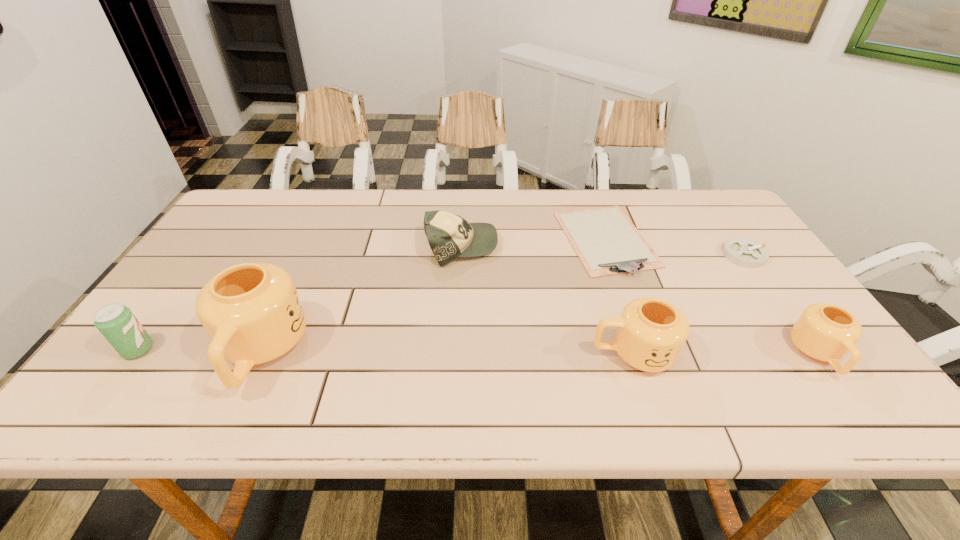
Where is `mug that is at the right edge`? Image resolution: width=960 pixels, height=540 pixels. mug that is at the right edge is located at coordinates (825, 332).

Locate an element on the screen. ashtray present at the right edge is located at coordinates (744, 252).

Where is `object that is at the near left corner`? The height and width of the screenshot is (540, 960). object that is at the near left corner is located at coordinates (116, 322).

I want to click on object at the near right corner, so click(825, 332).

In the image, there is a desktop. Where is `vacant space at the far edge`? vacant space at the far edge is located at coordinates (301, 205).

The image size is (960, 540). In order to click on vacant area at the left edge in this screenshot , I will do `click(166, 300)`.

The image size is (960, 540). What are the coordinates of `vacant point at the right edge` in the screenshot? It's located at (766, 334).

This screenshot has height=540, width=960. Find the location of `free location at the far left corner`. free location at the far left corner is located at coordinates tap(247, 214).

In the image, there is a desktop. Where is `free space at the far right corner`? The width and height of the screenshot is (960, 540). free space at the far right corner is located at coordinates (689, 188).

Locate an element on the screen. The height and width of the screenshot is (540, 960). free space that is in between the shortest mug and the second mug from left to right is located at coordinates (725, 354).